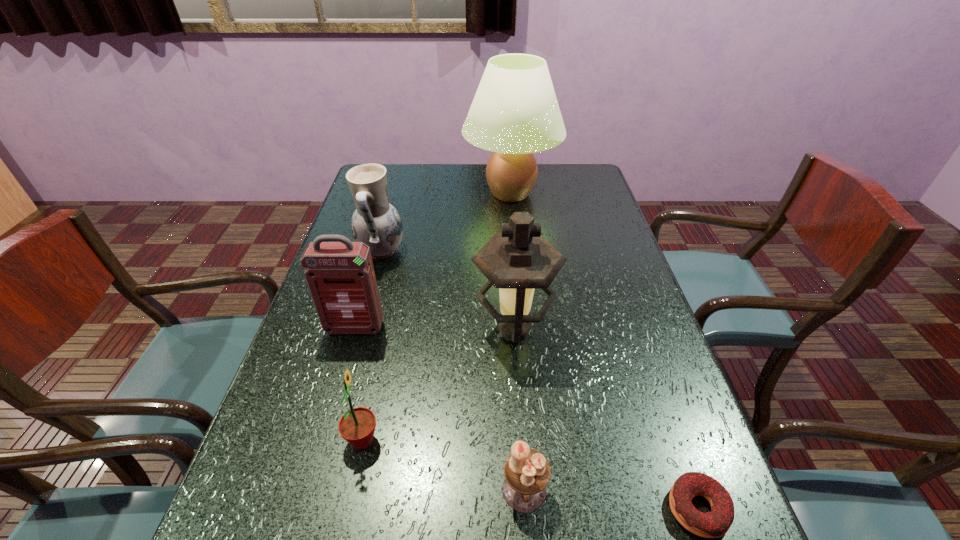
This screenshot has width=960, height=540. Identify the location of vacant space located 0.270m on the front-facing side of the first-aid kit. (322, 443).

The height and width of the screenshot is (540, 960). What are the coordinates of `vacant space located on either side of the second farthest object` in the screenshot? It's located at (533, 252).

The height and width of the screenshot is (540, 960). I want to click on vacant space located 0.060m on the face of the fifth farthest object, so [412, 440].

Locate an element on the screen. The height and width of the screenshot is (540, 960). free region located 0.270m on the back of the sixth tallest object is located at coordinates (514, 352).

Locate an element on the screen. object that is positioned at the far edge is located at coordinates (515, 113).

At what (x,y) coordinates should I click in order to perform the action: click on the first-aid kit that is at the left edge. Please return your answer as a coordinate pair (x, y). Looking at the image, I should click on pyautogui.click(x=340, y=275).

Locate an element on the screen. pottery present at the left edge is located at coordinates (375, 222).

Image resolution: width=960 pixels, height=540 pixels. In order to click on object present at the right edge in this screenshot , I will do `click(515, 113)`.

Identify the location of object positioned at the far right corner. (515, 113).

You are a GUI agent. You are given a task and a screenshot of the screen. Output one action in this format:
    pyautogui.click(x=<x>, y=<y>)
    Task: Click on the vacant space at the far edge of the desktop
    The image size is (960, 540).
    Given the screenshot: What is the action you would take?
    pyautogui.click(x=455, y=188)